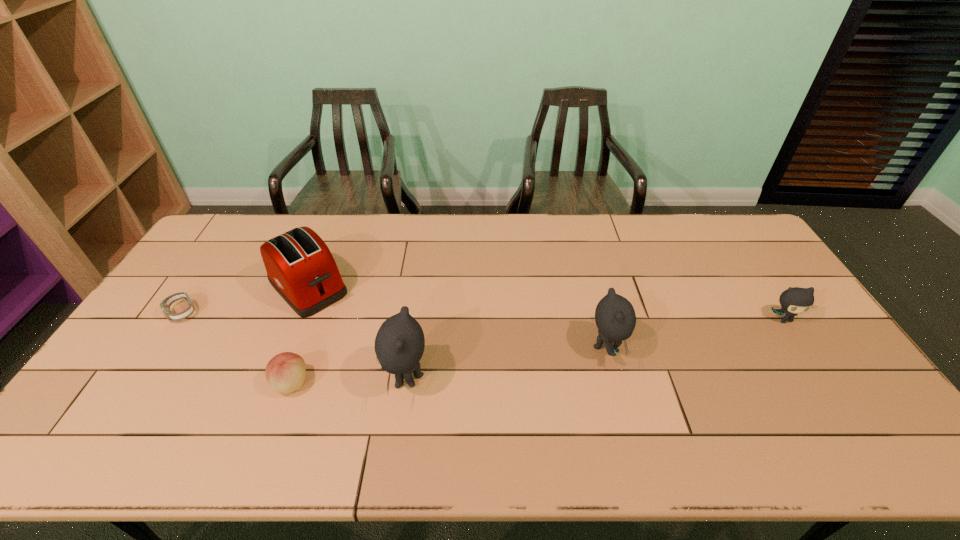
Image resolution: width=960 pixels, height=540 pixels. In order to click on vacant space located 0.330m on the front-facing side of the leftmost kitten in this screenshot , I will do `click(257, 379)`.

Locate an element on the screen. This screenshot has width=960, height=540. free space located on the front-facing side of the leftmost kitten is located at coordinates (230, 379).

This screenshot has width=960, height=540. In order to click on vacant region located on the front-facing side of the second shortest kitten in this screenshot , I will do `click(689, 347)`.

You are a GUI agent. You are given a task and a screenshot of the screen. Output one action in this format:
    pyautogui.click(x=<x>, y=<y>)
    Task: Click on the blank area located on the front-facing side of the shortest kitten
    This screenshot has height=540, width=960.
    Given the screenshot: What is the action you would take?
    pyautogui.click(x=801, y=344)

Where is `vacant space located 0.230m on the face of the watch`? This screenshot has height=540, width=960. vacant space located 0.230m on the face of the watch is located at coordinates (130, 393).

Identify the location of vacant space located 0.140m on the right of the toaster. This screenshot has height=540, width=960. (394, 287).

The height and width of the screenshot is (540, 960). What are the coordinates of `free space located 0.220m on the back of the second shortest object` in the screenshot? It's located at (319, 307).

Where is `kitten positioned at the near edge`? kitten positioned at the near edge is located at coordinates (399, 345).

You are a GUI agent. You are given a task and a screenshot of the screen. Output one action in this format:
    pyautogui.click(x=<x>, y=<y>)
    Task: Click on the peach located at the near edge
    
    Given the screenshot: What is the action you would take?
    pyautogui.click(x=285, y=372)

I want to click on object that is positioned at the left edge, so click(165, 305).